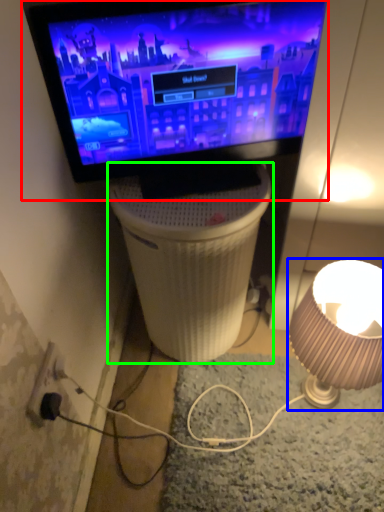
Question: Which is farther away from television (highlighted by a red box)? lamp (highlighted by a blue box) or table (highlighted by a green box)?

Choices:
 (A) lamp
 (B) table

Answer: (A)